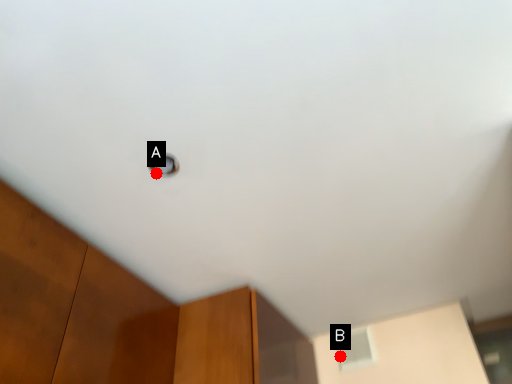
Question: Two points are circled on the image, labeled by A and B beside each circle. Which point is closer to the camera?

Choices:
 (A) A is closer
 (B) B is closer

Answer: (A)